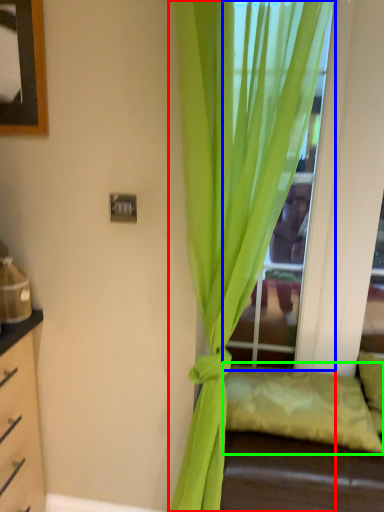
Question: Which object is positioned closest to curtain (highlighted by a red box)? Select from glass door (highlighted by a blue box) and pillow (highlighted by a green box).

Choices:
 (A) glass door
 (B) pillow

Answer: (A)